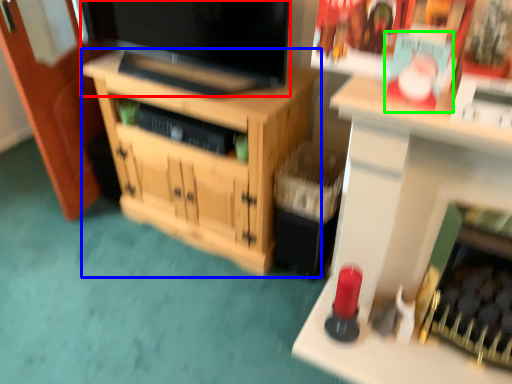
Question: Which object is the closest to the television (highlighted by a red box)? Choose among these: cabinetry (highlighted by a blue box) or magazine (highlighted by a green box).

Choices:
 (A) cabinetry
 (B) magazine

Answer: (A)